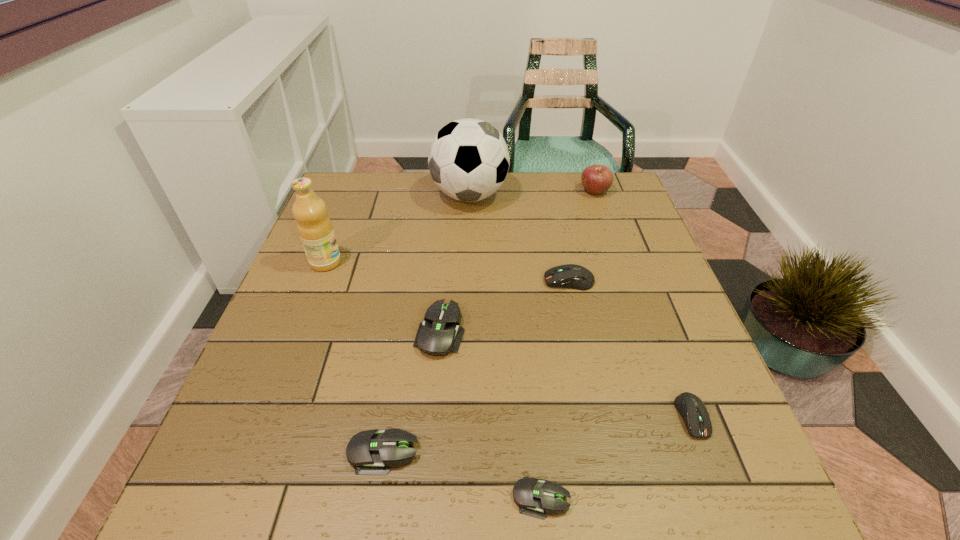
At what (x,y) coordinates should I click in order to perform the action: click on free space located 0.140m on the right of the fourth nearest computer mouse. Please return your answer as a coordinate pair (x, y). The width and height of the screenshot is (960, 540). Looking at the image, I should click on (530, 332).

Identify the location of free space located on the button of the right dark computer equipment. The image size is (960, 540). (717, 481).

At what (x,y) coordinates should I click in order to perform the action: click on vacant space located 0.070m on the right of the second nearest gray computer mouse. Please return your answer as a coordinate pair (x, y). Looking at the image, I should click on (460, 451).

Find the location of a particular element. Image resolution: width=960 pixels, height=540 pixels. vacant space situated on the back of the smallest gray computer mouse is located at coordinates [x=522, y=300].

Identify the location of soccer ball at the far edge. [x=468, y=160].

This screenshot has height=540, width=960. Identify the location of apple located at the far edge. (597, 179).

The width and height of the screenshot is (960, 540). Find the location of `object present at the left edge`. object present at the left edge is located at coordinates (315, 229).

Image resolution: width=960 pixels, height=540 pixels. I want to click on apple positioned at the right edge, so click(597, 179).

Where is `computer equipment at the right edge`? This screenshot has width=960, height=540. computer equipment at the right edge is located at coordinates (693, 411).

This screenshot has width=960, height=540. Find the location of `object present at the far right corner`. object present at the far right corner is located at coordinates (597, 179).